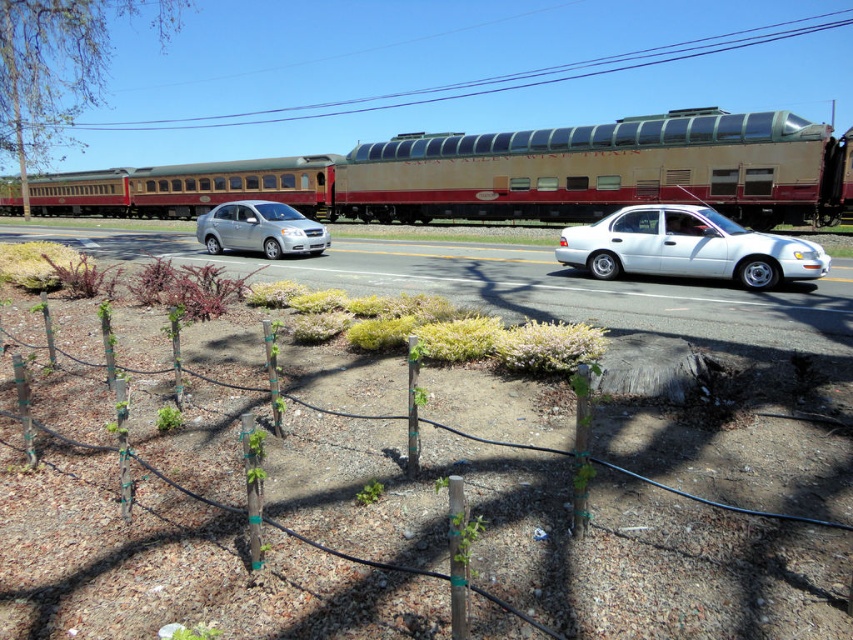
Looking at this image, you are standing at the point with coordinates (515,173) in the image. What object are you standing on?

The point with coordinates (515,173) is on the metallic gold train at center.

You are standing at the point closer to the camera between the two points, point (468, 161) and point (683, 218). Which point are you at?

You are at point (468, 161) because it is closer to the camera than point (683, 218).

You are a photographer trying to capture both the metallic gold train at center and the green leafy tree at upper left in the same frame. Based on their sizes in the image, which object would appear smaller in your photo?

The metallic gold train at center appears smaller in the photo compared to the green leafy tree at upper left because it is described as having a smaller size.